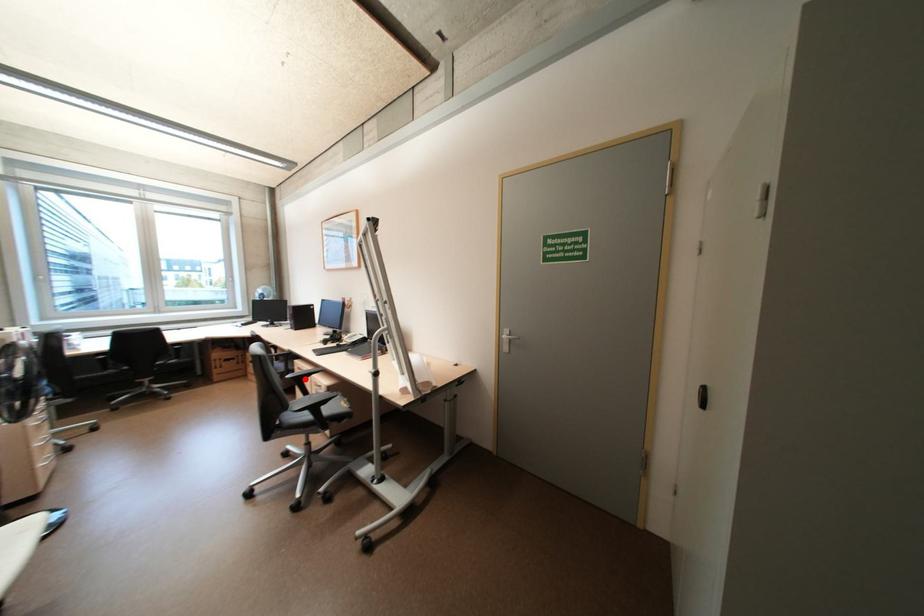
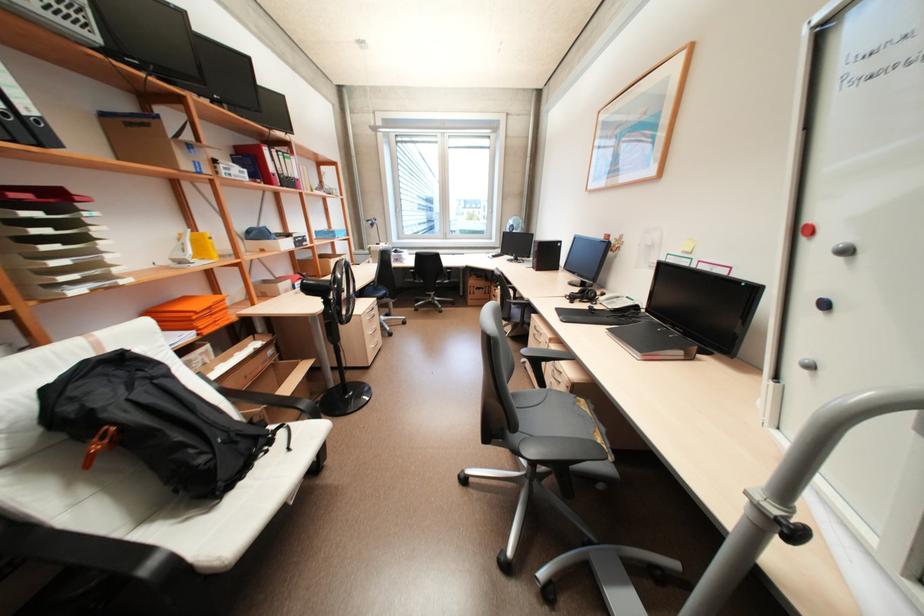
The point at the highlighted location is marked in the first image. Where is the corresponding point in the second image?

(542, 362)